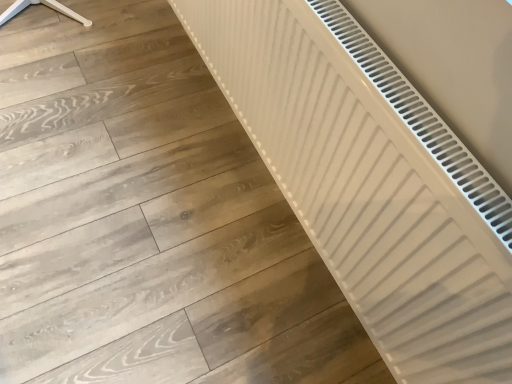
This screenshot has width=512, height=384. Describe the element at coordinates (371, 182) in the screenshot. I see `white matte radiator at right` at that location.

Identify the location of white matte radiator at right. This screenshot has width=512, height=384. (371, 182).

Where is `white matte radiator at right`? white matte radiator at right is located at coordinates (371, 182).